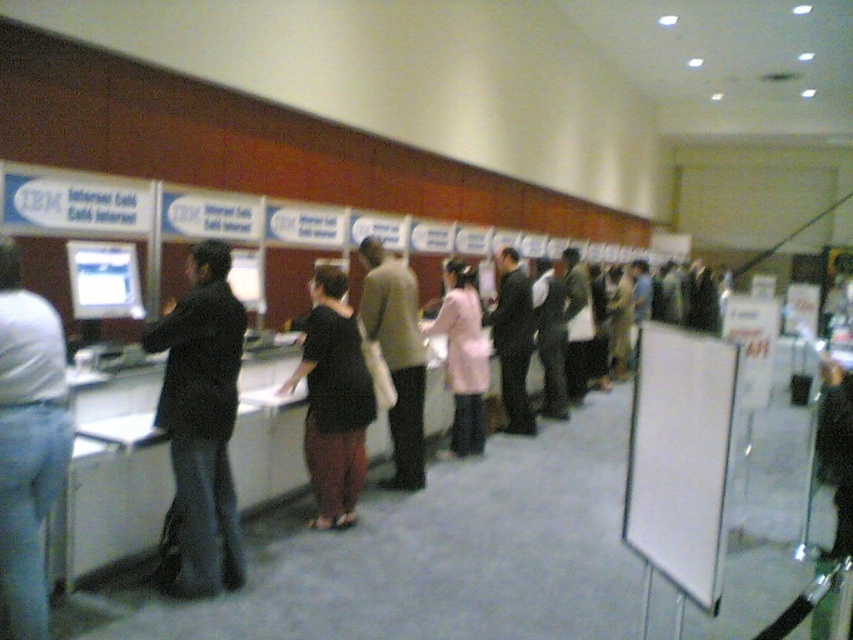
You are an event organizer at the IBM booth and need to ensure that all attendees can see the demonstration screen. You notice two attendees wearing dark blue jeans at center and pink fabric coat at center. Which attendee is standing closer to the screen?

The dark blue jeans at center is much taller than the pink fabric coat at center, so the attendee wearing dark blue jeans at center is closer to the screen.

You are an event organizer who needs to rearrange the white matte board at center and the dark gray suit at center to be closer together. What is the minimum distance you need to move them to achieve a separation of 2 meters between them?

The current distance between the white matte board at center and the dark gray suit at center is 4.27 meters. To reduce the separation to 2 meters, you need to move them a combined total of 2.27 meters closer together. This could involve moving one object 1.135 meters towards the other, or distributing the distance differently between the two.

You are an event planner at the IBM booth and need to place a new sign to the right of the dark gray suit at center. Where should you position it relative to the white matte board at center?

The white matte board at center is on the left side of the dark gray suit at center, so to place the new sign to the right of the dark gray suit at center, position it to the right of the white matte board at center.